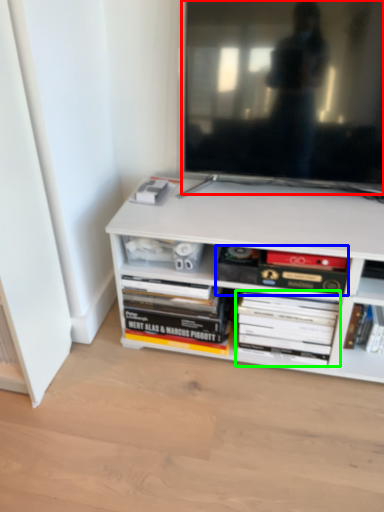
Question: Which object is positioned closest to television (highlighted by a red box)? Select from book (highlighted by a blue box) and book (highlighted by a green box).

Choices:
 (A) book
 (B) book

Answer: (A)